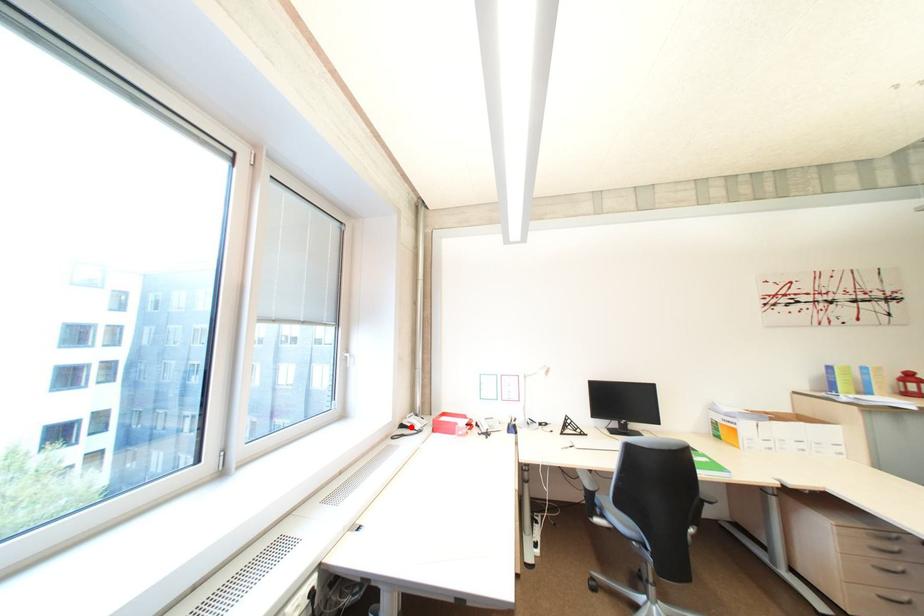
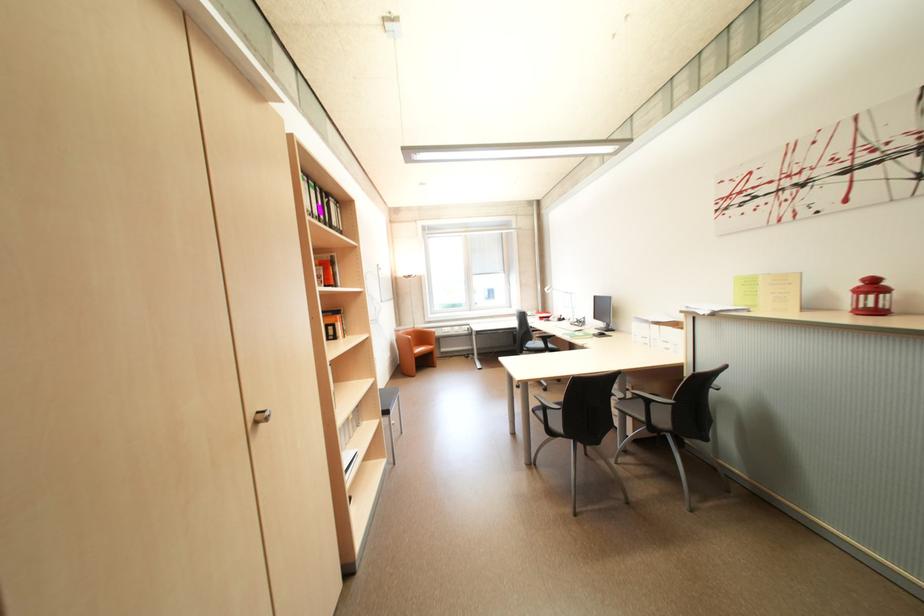
Question: I am providing you with two images of the same scene from different viewpoints. A red point is marked on the first image. At the location where the point appears in image 1, is it still visible in image 2?

Choices:
 (A) Yes
 (B) No

Answer: (B)